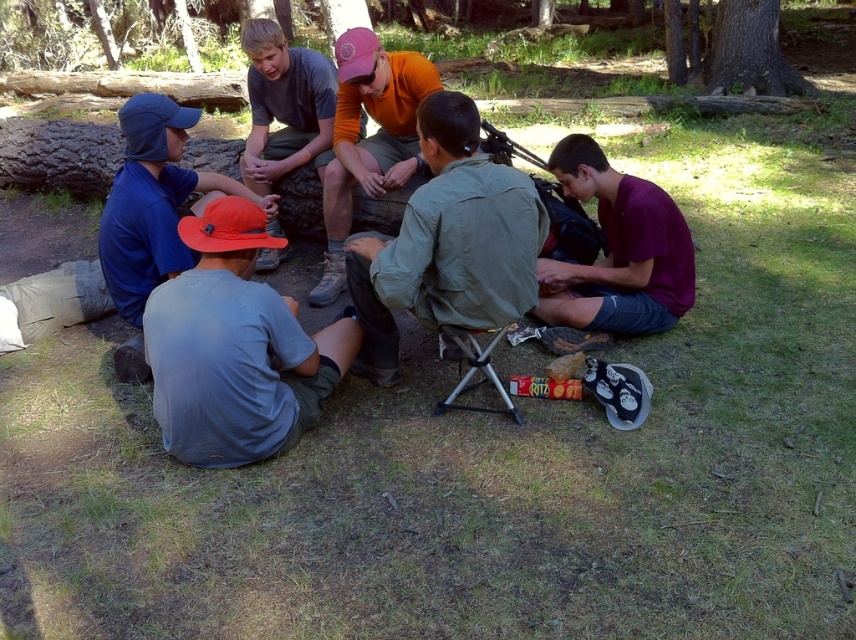
Question: Which of the following is the farthest from the observer?

Choices:
 (A) green canvas backpack at center
 (B) maroon fabric shirt at lower right
 (C) orange cotton shirt at center

Answer: (C)

Question: Can you confirm if gray cotton shirt at lower left is smaller than blue fabric cap at left?

Choices:
 (A) no
 (B) yes

Answer: (B)

Question: Can you confirm if blue fabric cap at left is smaller than maroon fabric shirt at lower right?

Choices:
 (A) no
 (B) yes

Answer: (A)

Question: Which is nearer to the gray cotton shirt at lower left?

Choices:
 (A) matte gray shirt at center
 (B) maroon fabric shirt at lower right
 (C) orange cotton shirt at center
 (D) blue fabric cap at left

Answer: (D)

Question: Which object is positioned closest to the matte gray shirt at center?

Choices:
 (A) maroon fabric shirt at lower right
 (B) gray cotton shirt at lower left
 (C) blue fabric cap at left

Answer: (C)

Question: Is green canvas backpack at center thinner than matte gray shirt at center?

Choices:
 (A) no
 (B) yes

Answer: (A)